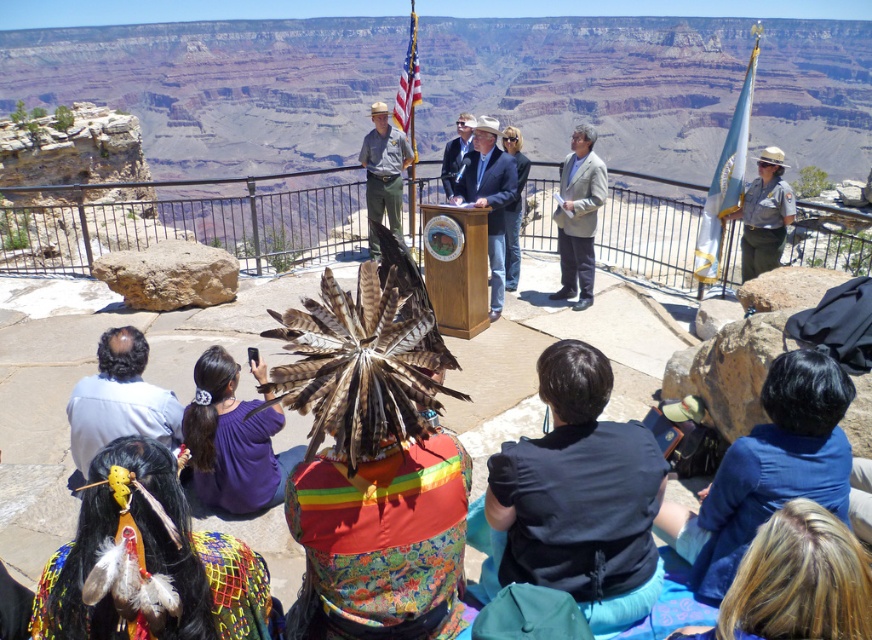
Between purple fabric at center and matte black jacket at center, which one is positioned higher?

matte black jacket at center is higher up.

Is purple fabric at center bigger than matte black jacket at center?

No.

Between point (253, 472) and point (447, 179), which one is positioned behind?

Positioned behind is point (447, 179).

At what (x,y) coordinates should I click in order to perform the action: click on purple fabric at center. Please return your answer as a coordinate pair (x, y). The image size is (872, 640). Looking at the image, I should click on (230, 440).

Does smooth wood podium at center have a greater width compared to american flag at center?

In fact, smooth wood podium at center might be narrower than american flag at center.

Can you confirm if smooth wood podium at center is thinner than american flag at center?

Yes.

The image size is (872, 640). Find the location of `smooth wood podium at center`. smooth wood podium at center is located at coordinates 489,196.

Does black matte shirt at center come in front of white fabric flag at right?

Yes, black matte shirt at center is in front of white fabric flag at right.

Does black matte shirt at center appear under white fabric flag at right?

Yes.

Between point (628, 420) and point (748, 77), which one is positioned behind?

The point (748, 77) is behind.

Image resolution: width=872 pixels, height=640 pixels. I want to click on black matte shirt at center, so click(577, 499).